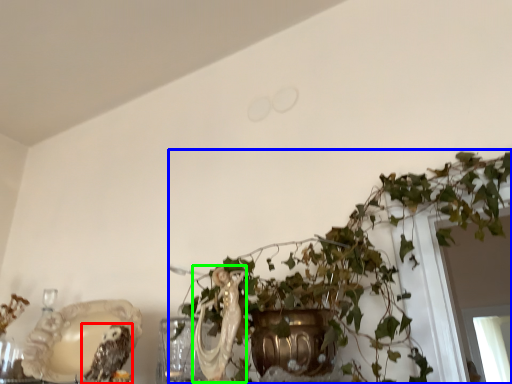
Question: Considering the real-world distances, which object is closest to owl (highlighted by a red box)? houseplant (highlighted by a blue box) or animal (highlighted by a green box).

Choices:
 (A) houseplant
 (B) animal

Answer: (B)